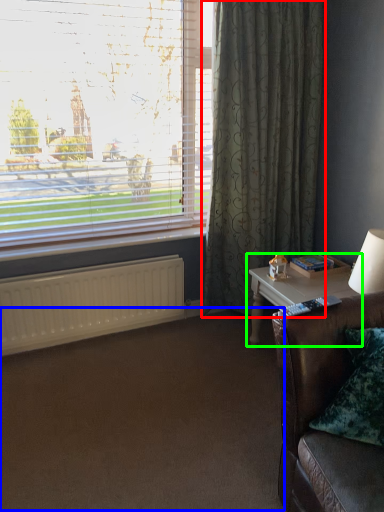
Question: Considering the real-world distances, which object is farthest from curtain (highlighted by a red box)? plain (highlighted by a blue box) or table (highlighted by a green box)?

Choices:
 (A) plain
 (B) table

Answer: (A)